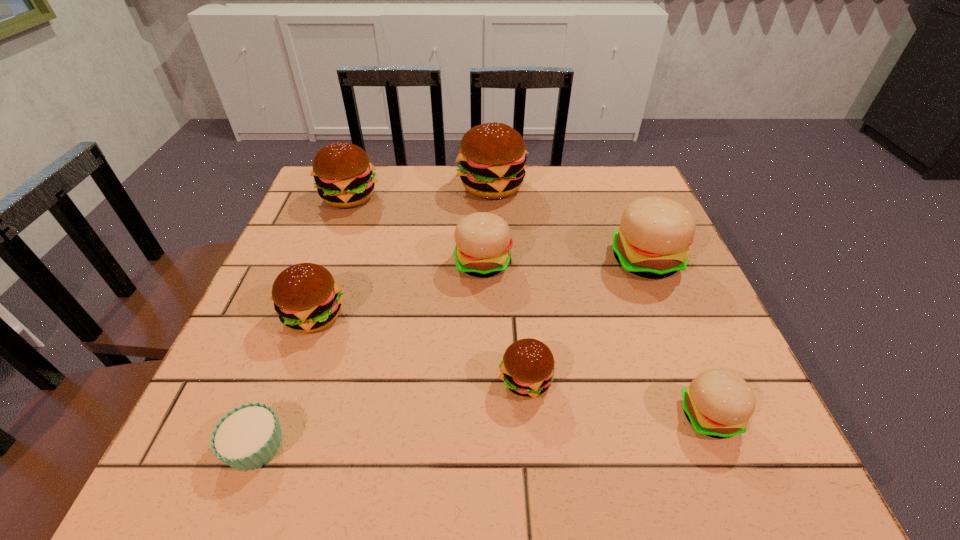
Find the location of a particular element. The image size is (960, 540). the seventh closest object relative to the second biggest brown hamburger is located at coordinates (718, 403).

Choose which hamburger is the nearest neighbor to the cupcake. Please provide its 2D coordinates. Your answer should be formatted as a tuple, i.e. [(x, y)], where the tuple contains the x and y coordinates of a point satisfying the conditions above.

[(307, 299)]

Point out which hamburger is positioned as the third nearest to the second biggest brown hamburger. Please provide its 2D coordinates. Your answer should be formatted as a tuple, i.e. [(x, y)], where the tuple contains the x and y coordinates of a point satisfying the conditions above.

[(307, 299)]

Locate an element on the screen. brown hamburger that stands as the fourth closest to the biggest beige hamburger is located at coordinates (344, 176).

Select which brown hamburger appears as the closest to the nearest beige hamburger. Please provide its 2D coordinates. Your answer should be formatted as a tuple, i.e. [(x, y)], where the tuple contains the x and y coordinates of a point satisfying the conditions above.

[(527, 368)]

Choose which beige hamburger is the nearest neighbor to the third nearest hamburger. Please provide its 2D coordinates. Your answer should be formatted as a tuple, i.e. [(x, y)], where the tuple contains the x and y coordinates of a point satisfying the conditions above.

[(483, 241)]

Where is `beige hamburger that can be found as the second closest to the smallest beige hamburger`? Image resolution: width=960 pixels, height=540 pixels. beige hamburger that can be found as the second closest to the smallest beige hamburger is located at coordinates (483, 241).

I want to click on vacant area that satisfies the following two spatial constraints: 1. on the front side of the tallest object; 2. on the left side of the biggest beige hamburger, so click(x=494, y=260).

This screenshot has width=960, height=540. Find the location of `free region that satisfies the following two spatial constraints: 1. on the front side of the third nearest hamburger; 2. on the left side of the third smallest brown hamburger`. free region that satisfies the following two spatial constraints: 1. on the front side of the third nearest hamburger; 2. on the left side of the third smallest brown hamburger is located at coordinates (304, 316).

Locate an element on the screen. free spot that satisfies the following two spatial constraints: 1. on the back side of the cupcake; 2. on the right side of the tallest object is located at coordinates (353, 186).